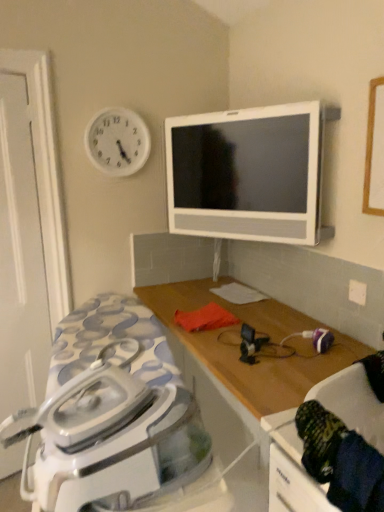
Question: From a real-world perspective, is white glossy iron at lower left located higher than white matte door at left?

Choices:
 (A) yes
 (B) no

Answer: (B)

Question: From the image's perspective, does white glossy iron at lower left appear higher than white matte door at left?

Choices:
 (A) no
 (B) yes

Answer: (A)

Question: Is white matte door at left inside white glossy iron at lower left?

Choices:
 (A) yes
 (B) no

Answer: (B)

Question: Does white glossy iron at lower left appear on the left side of white matte door at left?

Choices:
 (A) no
 (B) yes

Answer: (A)

Question: Is white glossy iron at lower left shorter than white matte door at left?

Choices:
 (A) yes
 (B) no

Answer: (A)

Question: In terms of width, does dark blue fabric swivel chair at lower right look wider or thinner when compared to white glossy iron at lower left?

Choices:
 (A) thin
 (B) wide

Answer: (A)

Question: Is dark blue fabric swivel chair at lower right to the left or to the right of white glossy iron at lower left in the image?

Choices:
 (A) right
 (B) left

Answer: (A)

Question: From a real-world perspective, is dark blue fabric swivel chair at lower right physically located above or below white glossy iron at lower left?

Choices:
 (A) above
 (B) below

Answer: (A)

Question: In terms of height, does dark blue fabric swivel chair at lower right look taller or shorter compared to white glossy iron at lower left?

Choices:
 (A) short
 (B) tall

Answer: (A)

Question: From the image's perspective, relative to white glossy television at upper center, is dark blue fabric swivel chair at lower right above or below?

Choices:
 (A) above
 (B) below

Answer: (B)

Question: In terms of width, does dark blue fabric swivel chair at lower right look wider or thinner when compared to white glossy television at upper center?

Choices:
 (A) wide
 (B) thin

Answer: (A)

Question: In the image, is dark blue fabric swivel chair at lower right positioned in front of or behind white glossy television at upper center?

Choices:
 (A) front
 (B) behind

Answer: (A)

Question: Is dark blue fabric swivel chair at lower right taller or shorter than white glossy television at upper center?

Choices:
 (A) tall
 (B) short

Answer: (B)

Question: In the image, is white glossy television at upper center on the left side or the right side of wooden table at center?

Choices:
 (A) right
 (B) left

Answer: (B)

Question: In the image, is white glossy television at upper center positioned in front of or behind wooden table at center?

Choices:
 (A) front
 (B) behind

Answer: (B)